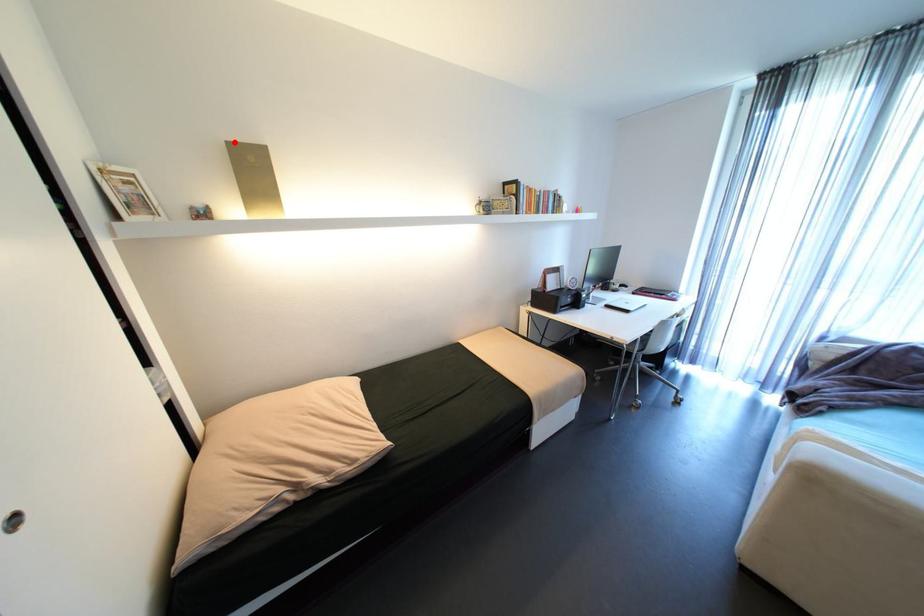
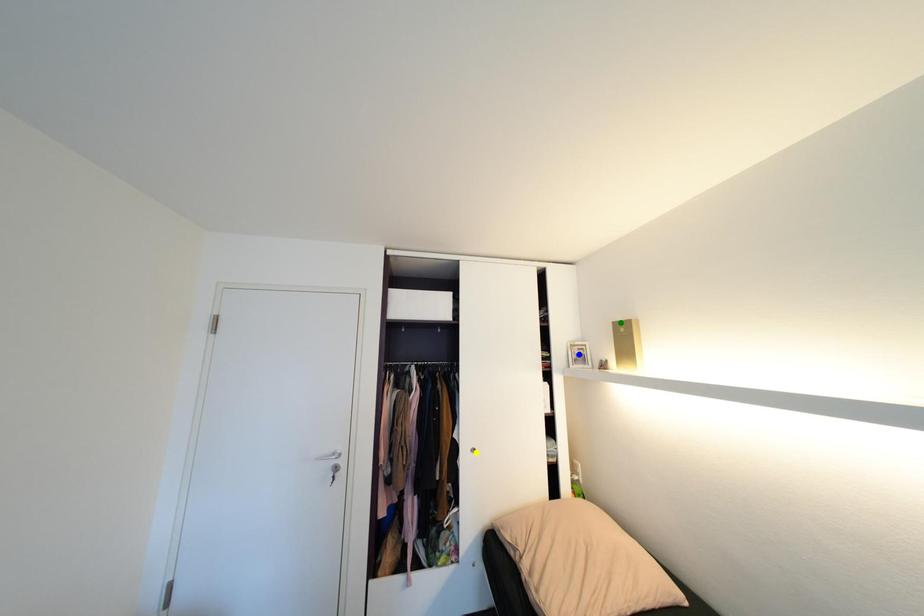
Question: I am providing you with two images of the same scene from different viewpoints. A red point is marked on the first image. You are given multiple points on the second image. Which mark in image 2 goes with the point in image 1?

Choices:
 (A) blue point
 (B) green point
 (C) yellow point

Answer: (B)